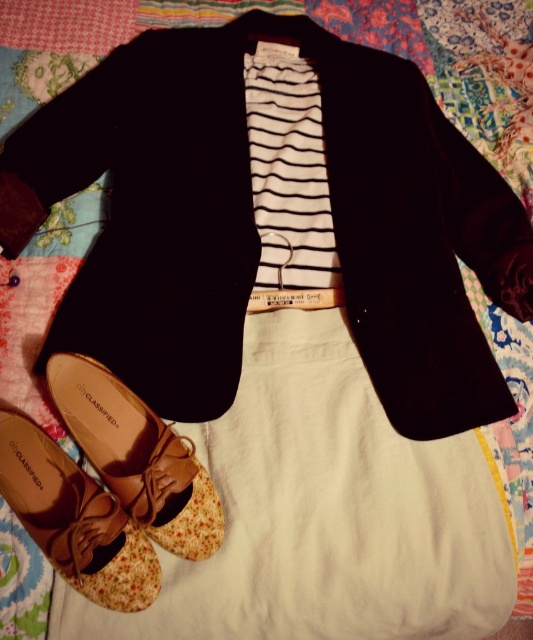
Question: Can you confirm if black cotton jacket at center is positioned above brown fabric shoe at lower left?

Choices:
 (A) yes
 (B) no

Answer: (A)

Question: Which of the following is the closest to the observer?

Choices:
 (A) (56, 550)
 (B) (68, 88)

Answer: (A)

Question: Which of the following is the closest to the observer?

Choices:
 (A) brown fabric shoe at lower left
 (B) black cotton jacket at center

Answer: (A)

Question: Which of the following is the farthest from the observer?

Choices:
 (A) brown fabric shoe at lower left
 (B) black cotton jacket at center
 (C) brown leather shoe at lower left

Answer: (B)

Question: Can you confirm if black cotton jacket at center is wider than brown fabric shoe at lower left?

Choices:
 (A) no
 (B) yes

Answer: (B)

Question: Can you confirm if brown leather shoe at lower left is positioned below brown fabric shoe at lower left?

Choices:
 (A) yes
 (B) no

Answer: (B)